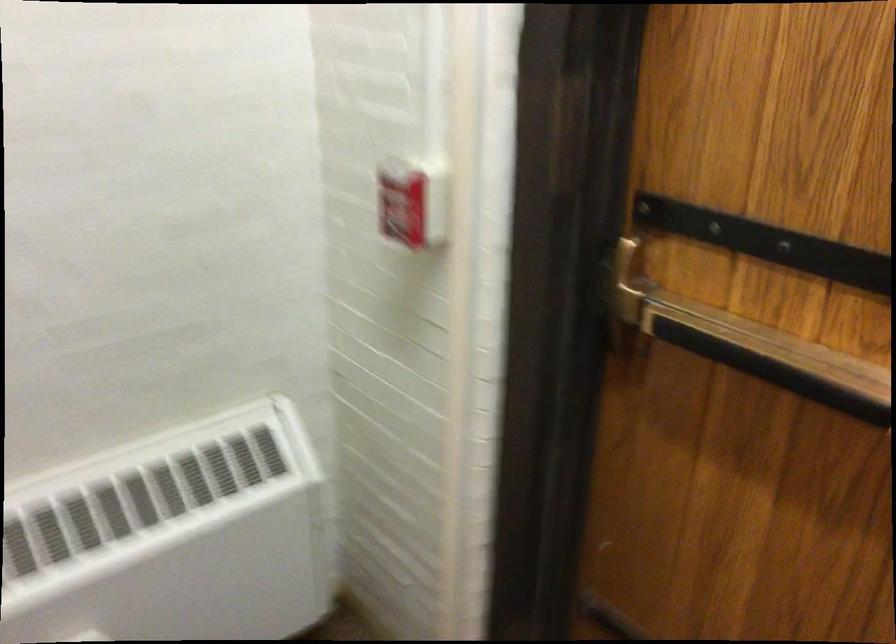
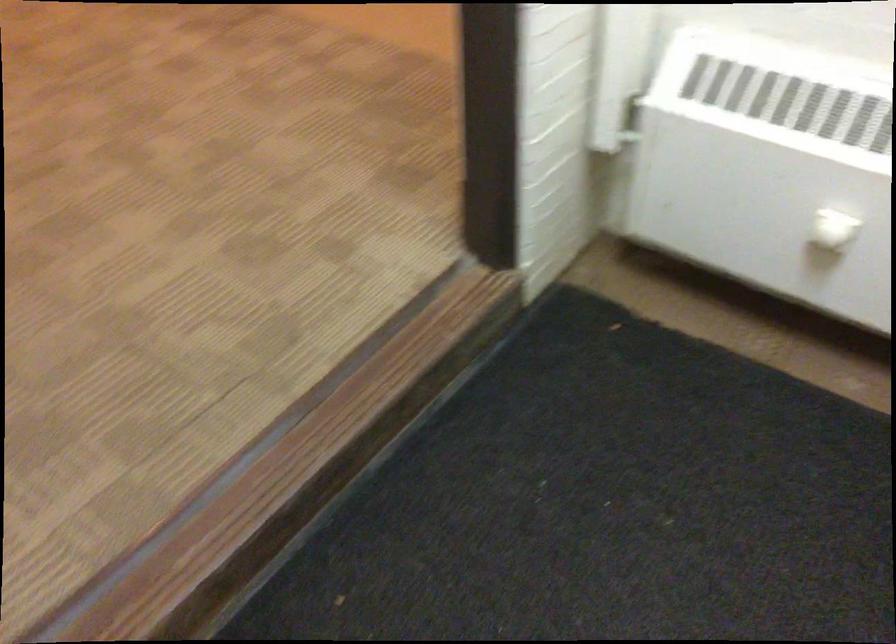
The first image is from the beginning of the video and the second image is from the end. How did the camera likely rotate when shooting the video?

The camera's rotation is toward left-down.